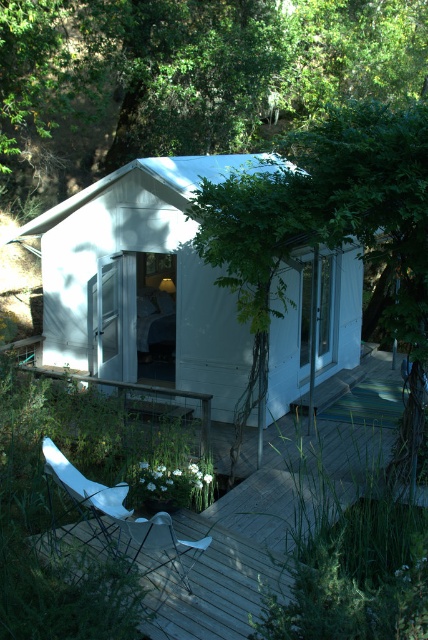
You are planning to place a large potted plant on the wooden deck at center. Considering the white matte hut at center is already there, where should you place the potted plant to ensure it doesn not block the view from the hut?

The white matte hut at center is positioned on the left side of wooden deck at center, so placing the potted plant on the right side of the wooden deck at center would avoid blocking the view from the hut.

You are planning to set up a small garden between the white matte hut at center and the white plastic chair at lower left. Considering their heights, which object might block the sunlight for the garden more?

The white plastic chair at lower left is taller than the white matte hut at center, so it would block more sunlight for the garden.

You are standing on the wooden deck at center and want to move to the white plastic chair at lower left. In which direction should you walk to reach the chair?

You should walk to the left because the wooden deck at center is to the right of the white plastic chair at lower left, meaning the chair is located to your left side.